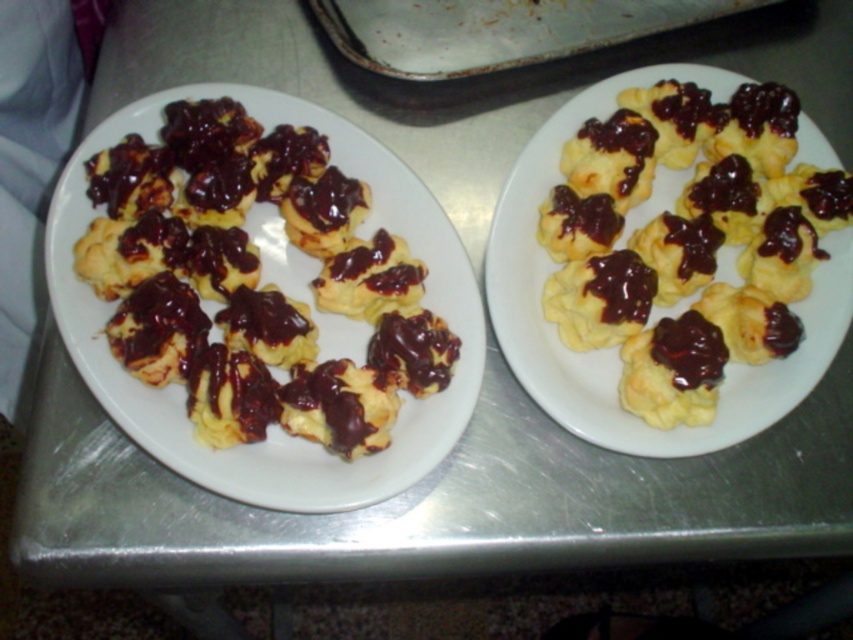
Between matte yellow puff pastries at left and brushed metal tray at upper center, which one appears on the left side from the viewer's perspective?

matte yellow puff pastries at left is more to the left.

Is matte yellow puff pastries at left positioned in front of brushed metal tray at upper center?

Yes.

Does point (444, 310) come farther from viewer compared to point (566, 22)?

No, it is not.

Image resolution: width=853 pixels, height=640 pixels. What are the coordinates of `matte yellow puff pastries at left` in the screenshot? It's located at (276, 426).

Is matte yellow puff pastries at left to the right of yellow matte puff pastry at center from the viewer's perspective?

In fact, matte yellow puff pastries at left is to the left of yellow matte puff pastry at center.

Can you confirm if matte yellow puff pastries at left is smaller than yellow matte puff pastry at center?

No.

Which is in front, point (80, 228) or point (505, 252)?

Point (80, 228)

At what (x,y) coordinates should I click in order to perform the action: click on matte yellow puff pastries at left. Please return your answer as a coordinate pair (x, y). This screenshot has height=640, width=853. Looking at the image, I should click on (276, 426).

Which is behind, point (711, 76) or point (367, 3)?

Point (367, 3)

Does yellow matte puff pastry at center have a larger size compared to brushed metal tray at upper center?

Yes, yellow matte puff pastry at center is bigger than brushed metal tray at upper center.

Is point (755, 408) farther from viewer compared to point (550, 40)?

No, (755, 408) is closer to viewer.

The image size is (853, 640). I want to click on yellow matte puff pastry at center, so click(614, 348).